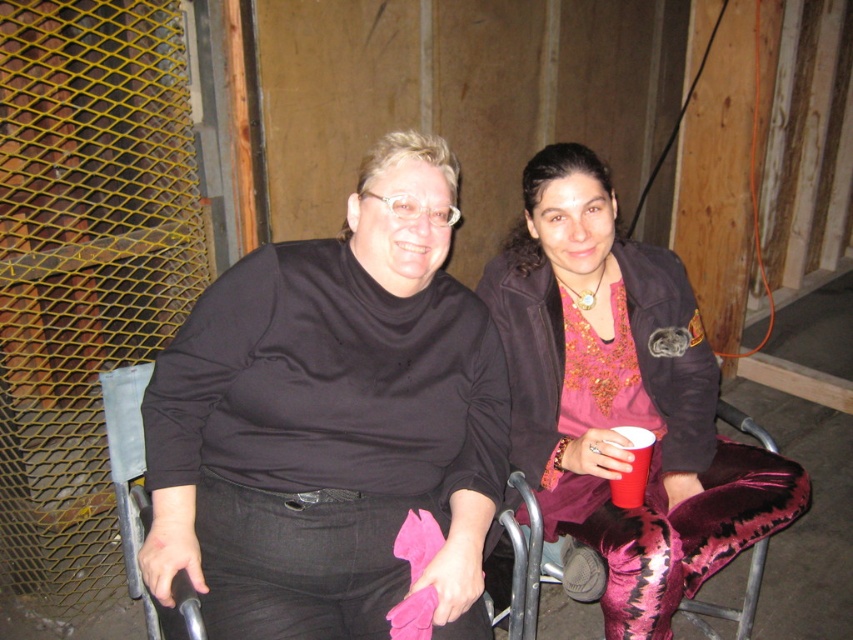
Question: Can you confirm if velvet leggings at center is positioned above red plastic cup at right?

Choices:
 (A) yes
 (B) no

Answer: (A)

Question: Among these points, which one is nearest to the camera?

Choices:
 (A) (543, 172)
 (B) (741, 429)
 (C) (544, 525)

Answer: (A)

Question: Which point is farther to the camera?

Choices:
 (A) velvet pink pants at center
 (B) red plastic cup at right

Answer: (B)

Question: Does velvet leggings at center appear on the left side of red plastic cup at right?

Choices:
 (A) no
 (B) yes

Answer: (B)

Question: Is velvet leggings at center smaller than velvet pink pants at center?

Choices:
 (A) yes
 (B) no

Answer: (B)

Question: Which of the following is the farthest from the observer?

Choices:
 (A) (648, 458)
 (B) (761, 540)

Answer: (B)